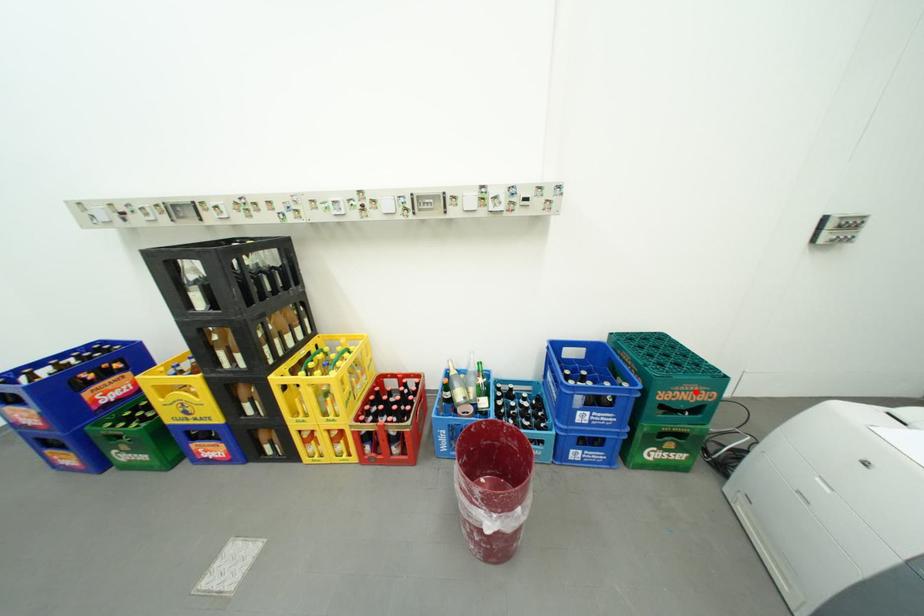
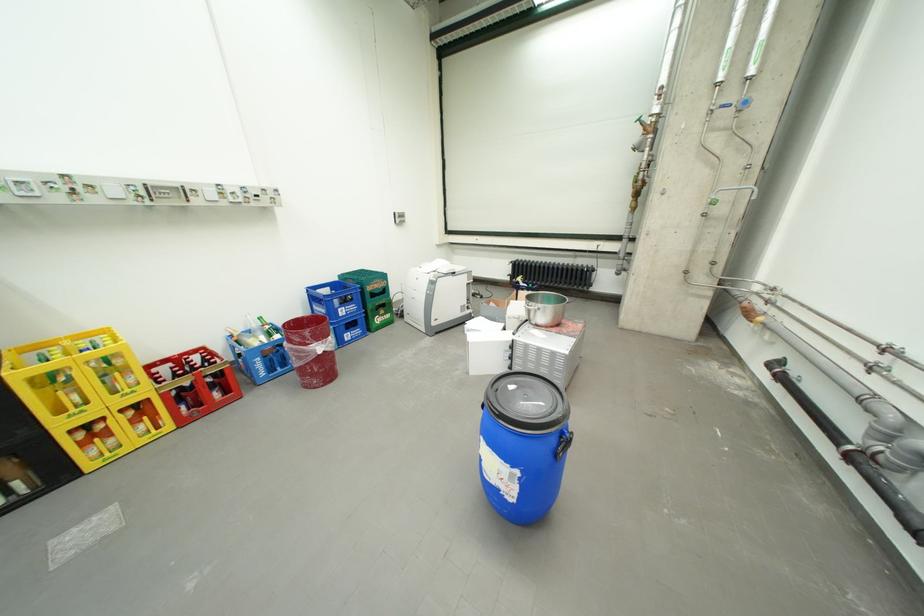
Where in the second image is the point corresponding to the highlighted location from the first image?

(386, 285)